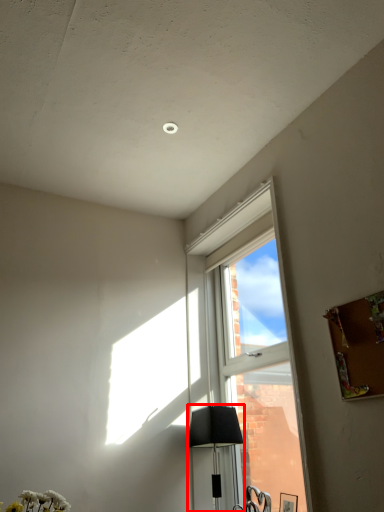
Question: In this image, where is lamp (annotated by the red box) located relative to window?

Choices:
 (A) left
 (B) right

Answer: (A)